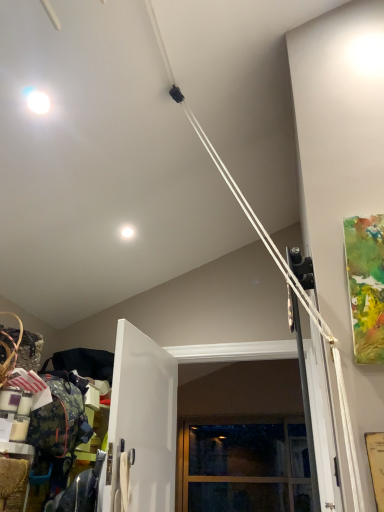
Question: Looking at their shapes, would you say clear glass window at center is wider or thinner than white glossy droplight at upper center?

Choices:
 (A) thin
 (B) wide

Answer: (B)

Question: Is clear glass window at center bigger or smaller than white glossy droplight at upper center?

Choices:
 (A) big
 (B) small

Answer: (A)

Question: Which object is positioned closest to the white glossy droplight at upper center?

Choices:
 (A) clear glass window at center
 (B) white glossy door at center

Answer: (B)

Question: Which object is the farthest from the white glossy droplight at upper center?

Choices:
 (A) white glossy door at center
 (B) clear glass window at center

Answer: (B)